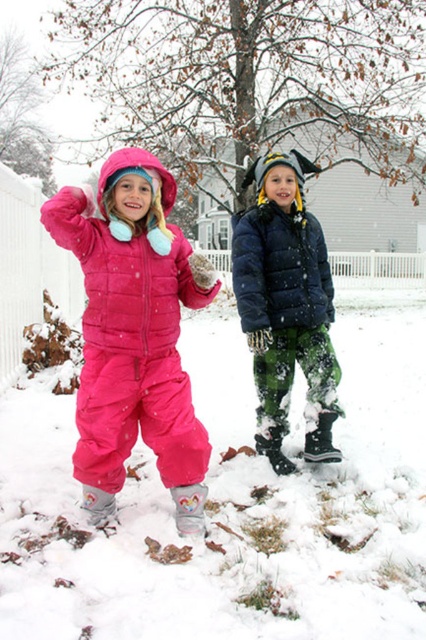
Question: Which point appears farthest from the camera in this image?

Choices:
 (A) (339, 456)
 (B) (169, 202)

Answer: (A)

Question: Among these objects, which one is farthest from the camera?

Choices:
 (A) matte black jacket at center
 (B) pink matte snowsuit at center

Answer: (A)

Question: Is pink matte snowsuit at center smaller than matte black jacket at center?

Choices:
 (A) yes
 (B) no

Answer: (A)

Question: Which of the following is the closest to the observer?

Choices:
 (A) pink matte snowsuit at center
 (B) matte black jacket at center

Answer: (A)

Question: Can you confirm if pink matte snowsuit at center is thinner than matte black jacket at center?

Choices:
 (A) no
 (B) yes

Answer: (A)

Question: Does pink matte snowsuit at center have a greater width compared to matte black jacket at center?

Choices:
 (A) no
 (B) yes

Answer: (B)